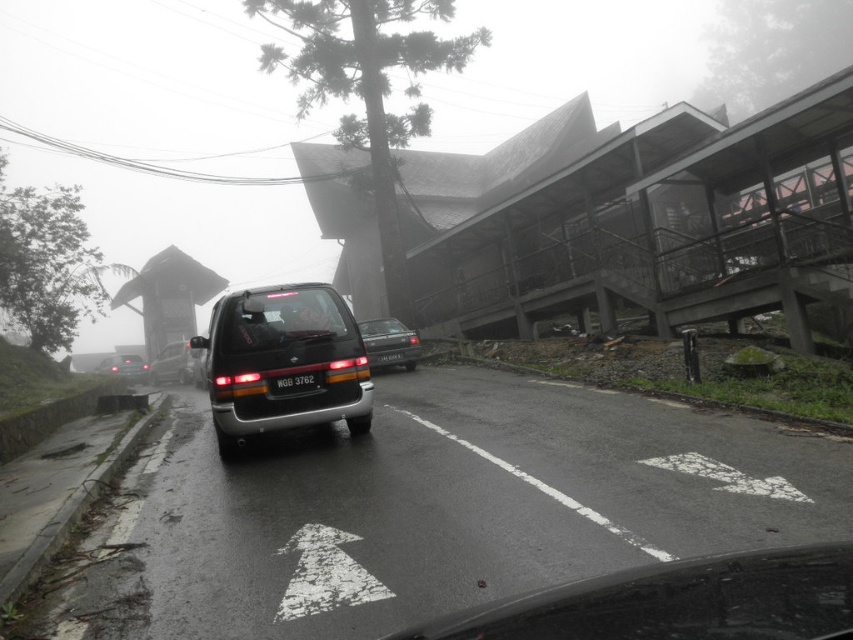
You are a delivery driver navigating a wet road with low visibility. You see the satin black van at center. Based on its position, can you estimate its coordinates on the road?

The satin black van at center is located at coordinates point (283, 362).

You are driving a car that requires a 10 meter braking distance to stop safely. You see the satin black van at center and the satin silver sedan at center ahead on the wet road. Can you safely stop before hitting either vehicle?

The distance between the satin black van at center and satin silver sedan at center is 7.68 meters. Since your car needs 10 meters to stop, you cannot safely stop before hitting either vehicle.

You are driving a car and see the satin black van at center and the satin silver sedan at center ahead. Which vehicle is closer to you?

The satin black van at center is closer to you since it is positioned in front of the satin silver sedan at center.